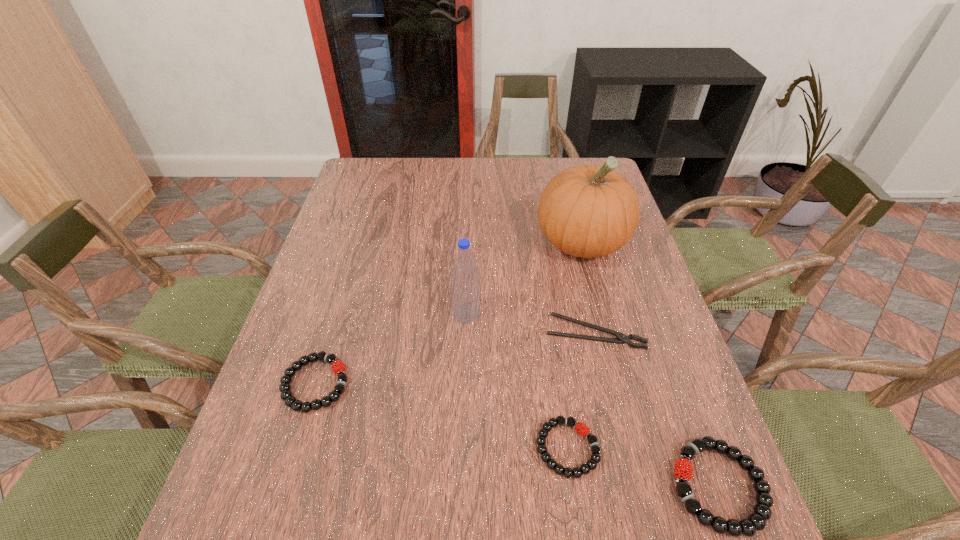
The width and height of the screenshot is (960, 540). In the image, there is a desktop. Identify the location of vacant space at the far edge. click(x=550, y=175).

The width and height of the screenshot is (960, 540). I want to click on blank space at the near edge, so pyautogui.click(x=479, y=467).

Find the location of a particular element. This screenshot has width=960, height=540. vacant space at the left edge is located at coordinates (304, 330).

At what (x,y) coordinates should I click in order to perform the action: click on free space at the right edge of the desktop. Please return your answer as a coordinate pair (x, y). Looking at the image, I should click on (634, 239).

At what (x,y) coordinates should I click in order to perform the action: click on vacant space at the near left corner of the desktop. Please return your answer as a coordinate pair (x, y). The height and width of the screenshot is (540, 960). Looking at the image, I should click on (242, 448).

Locate an element on the screen. This screenshot has height=540, width=960. vacant space at the near right corner of the desktop is located at coordinates coord(636,461).

The height and width of the screenshot is (540, 960). Find the location of `vacant region between the farthest object and the second bracelet from left to right`. vacant region between the farthest object and the second bracelet from left to right is located at coordinates [574, 345].

Where is `free space between the rightmost bracelet and the fourth farthest object`? The height and width of the screenshot is (540, 960). free space between the rightmost bracelet and the fourth farthest object is located at coordinates (516, 435).

What are the coordinates of `vacant region between the shortest bracelet and the water bottle` in the screenshot? It's located at (516, 381).

Identify the location of free spot between the pumpkin and the tongs. (588, 288).